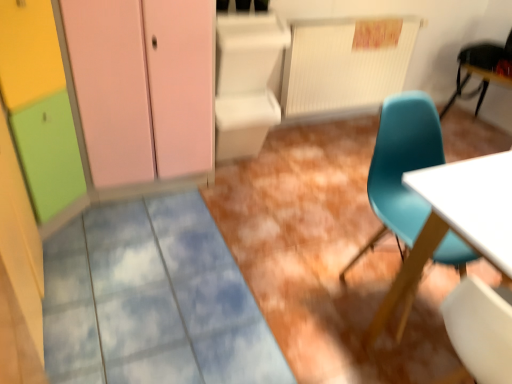
Question: From the image's perspective, is teal plastic chair at upper right, which is the first chair from right to left, on matte plastic chair at right, which is the second chair from back to front?

Choices:
 (A) yes
 (B) no

Answer: (A)

Question: Is teal plastic chair at upper right, arranged as the 2th chair when ordered from the bottom, positioned beyond the bounds of matte plastic chair at right, the first chair viewed from the left?

Choices:
 (A) no
 (B) yes

Answer: (B)

Question: Considering the relative positions of teal plastic chair at upper right, the 2th chair positioned from the front, and matte plastic chair at right, which is the second chair from back to front, in the image provided, is teal plastic chair at upper right, the 2th chair positioned from the front, to the right of matte plastic chair at right, which is the second chair from back to front, from the viewer's perspective?

Choices:
 (A) yes
 (B) no

Answer: (A)

Question: From a real-world perspective, is teal plastic chair at upper right, the 2th chair positioned from the front, located beneath matte plastic chair at right, the first chair viewed from the left?

Choices:
 (A) yes
 (B) no

Answer: (B)

Question: Does teal plastic chair at upper right, which ranks as the first chair in back-to-front order, have a smaller size compared to matte plastic chair at right, the 2th chair in the top-to-bottom sequence?

Choices:
 (A) no
 (B) yes

Answer: (B)

Question: Would you say matte pink cabinet at upper left is to the left or to the right of teal plastic chair at upper right, which is the first chair from right to left, in the picture?

Choices:
 (A) left
 (B) right

Answer: (A)

Question: From a real-world perspective, is matte pink cabinet at upper left positioned above or below teal plastic chair at upper right, which appears as the 2th chair when viewed from the left?

Choices:
 (A) above
 (B) below

Answer: (A)

Question: Is matte pink cabinet at upper left inside or outside of teal plastic chair at upper right, which appears as the 2th chair when viewed from the left?

Choices:
 (A) inside
 (B) outside

Answer: (B)

Question: Is point (179, 97) positioned closer to the camera than point (460, 61)?

Choices:
 (A) farther
 (B) closer

Answer: (B)

Question: Is teal plastic chair at upper right, which appears as the 2th chair when viewed from the left, in front of or behind matte plastic chair at right, the 2th chair in the top-to-bottom sequence, in the image?

Choices:
 (A) front
 (B) behind

Answer: (B)

Question: Visually, is teal plastic chair at upper right, arranged as the 2th chair when ordered from the bottom, positioned to the left or to the right of matte plastic chair at right, arranged as the 1th chair when ordered from the bottom?

Choices:
 (A) left
 (B) right

Answer: (B)

Question: In terms of height, does teal plastic chair at upper right, the 1th chair viewed from the top, look taller or shorter compared to matte plastic chair at right, which is the second chair from back to front?

Choices:
 (A) short
 (B) tall

Answer: (A)

Question: From a real-world perspective, relative to matte plastic chair at right, the first chair from the front, is teal plastic chair at upper right, arranged as the 2th chair when ordered from the bottom, vertically above or below?

Choices:
 (A) above
 (B) below

Answer: (A)

Question: Considering the positions of matte plastic chair at right, the first chair viewed from the left, and teal plastic chair at upper right, the 2th chair positioned from the front, in the image, is matte plastic chair at right, the first chair viewed from the left, bigger or smaller than teal plastic chair at upper right, the 2th chair positioned from the front,?

Choices:
 (A) big
 (B) small

Answer: (A)

Question: Is matte plastic chair at right, marked as the second chair in a right-to-left arrangement, taller or shorter than teal plastic chair at upper right, which is the first chair from right to left?

Choices:
 (A) short
 (B) tall

Answer: (B)